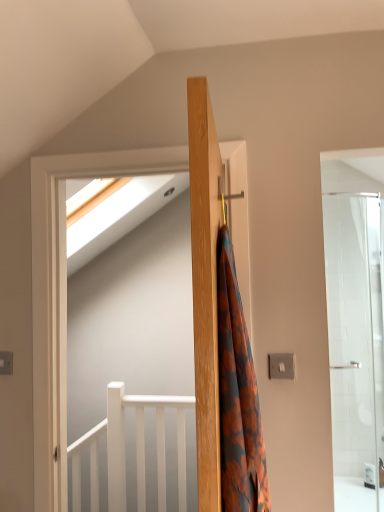
Question: Visually, is orange floral fabric at center positioned to the left or to the right of wooden coat hanger at center?

Choices:
 (A) right
 (B) left

Answer: (A)

Question: Is point (218, 327) positioned closer to the camera than point (215, 223)?

Choices:
 (A) closer
 (B) farther

Answer: (B)

Question: Which of these objects is positioned farthest from the white glossy screen door at upper left?

Choices:
 (A) white matte balustrade at lower left
 (B) wooden coat hanger at center
 (C) orange floral fabric at center

Answer: (C)

Question: Based on their relative distances, which object is nearer to the wooden coat hanger at center?

Choices:
 (A) orange floral fabric at center
 (B) white glossy screen door at upper left
 (C) white matte balustrade at lower left

Answer: (A)